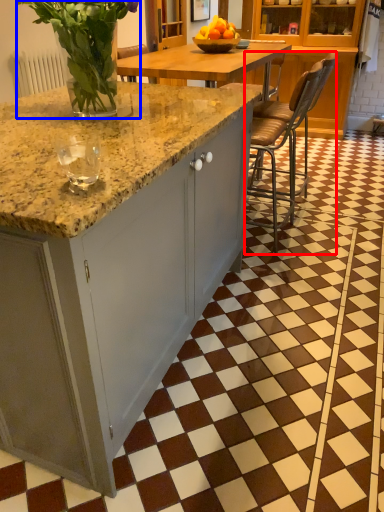
Question: Which point is closer to the camera, chair (highlighted by a red box) or floral arrangement (highlighted by a blue box)?

Choices:
 (A) chair
 (B) floral arrangement

Answer: (B)